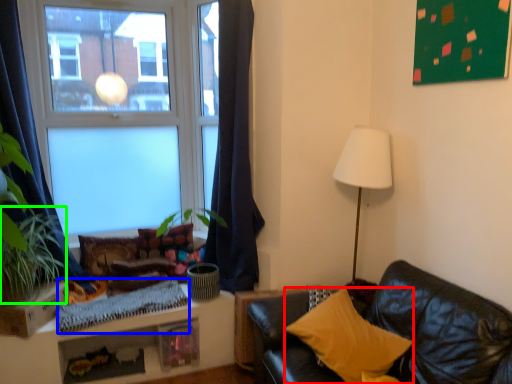
Question: Which is nearer to the pillow (highlighted by a red box)? blanket (highlighted by a blue box) or plant (highlighted by a green box).

Choices:
 (A) blanket
 (B) plant

Answer: (A)